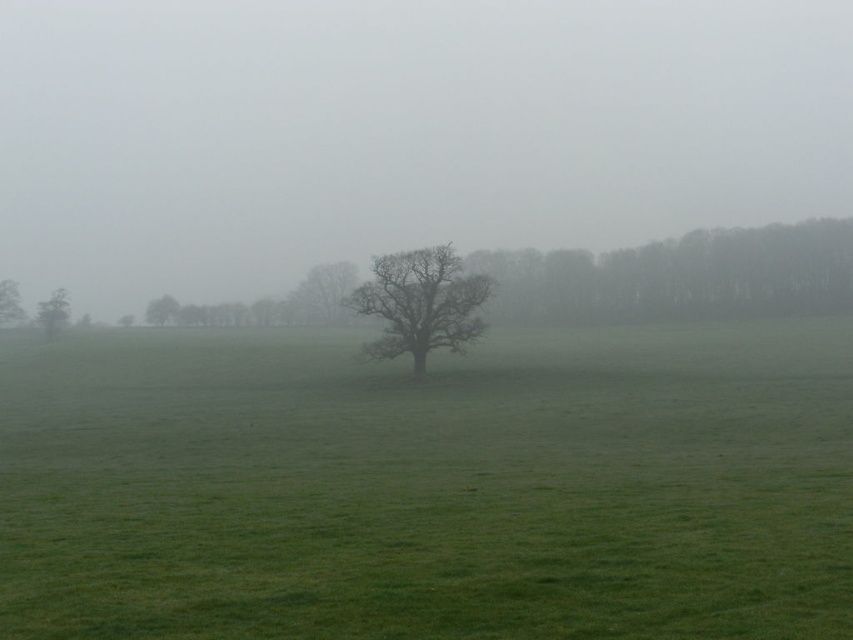
Question: Is bare wood tree at center smaller than smooth gray tree at center?

Choices:
 (A) no
 (B) yes

Answer: (B)

Question: Among these objects, which one is nearest to the camera?

Choices:
 (A) foggy translucent tree at center
 (B) green grass pasture at center
 (C) smooth gray tree at center
 (D) bare wood tree at center

Answer: (B)

Question: Does foggy translucent tree at center have a larger size compared to smooth brown tree at left?

Choices:
 (A) no
 (B) yes

Answer: (B)

Question: Which object appears farthest from the camera in this image?

Choices:
 (A) smooth gray tree at center
 (B) bare wood tree at center
 (C) green grass pasture at center
 (D) foggy translucent tree at center

Answer: (D)

Question: Among these points, which one is farthest from the camera?

Choices:
 (A) pos(502,184)
 (B) pos(157,317)
 (C) pos(489,528)
 (D) pos(350,278)

Answer: (A)

Question: Does foggy translucent tree at center appear on the right side of smooth brown tree at left?

Choices:
 (A) yes
 (B) no

Answer: (A)